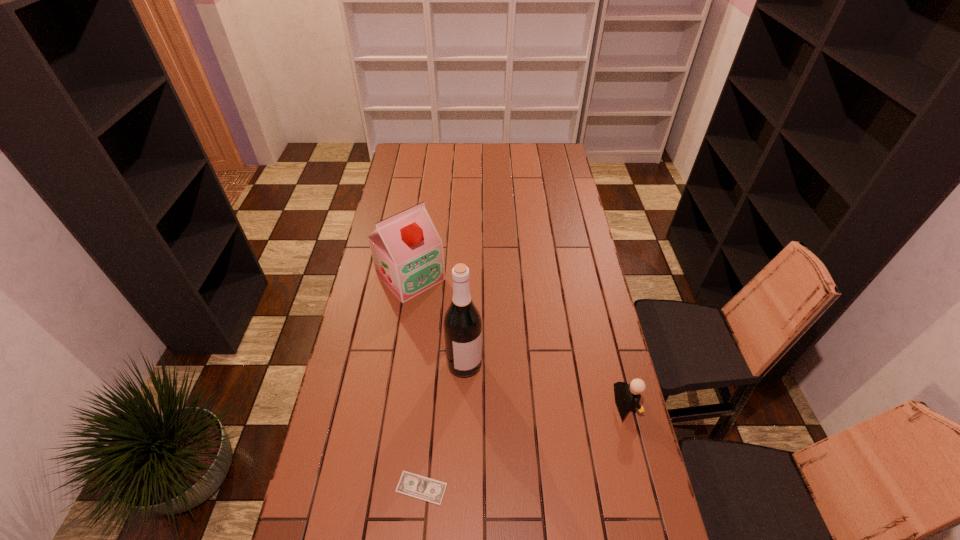
In the image, there is a desktop. Where is `vacant space at the right edge`? The image size is (960, 540). vacant space at the right edge is located at coordinates point(561,269).

This screenshot has width=960, height=540. What are the coordinates of `free space at the near left corner` in the screenshot? It's located at (311, 504).

Where is `vacant space in between the money and the tallest object`? vacant space in between the money and the tallest object is located at coordinates (443, 426).

Locate an element on the screen. The image size is (960, 540). vacant area that lies between the shortest object and the second nearest object is located at coordinates (524, 446).

Image resolution: width=960 pixels, height=540 pixels. Identify the location of empty space that is in between the rightmost object and the money. (524, 446).

Locate an element on the screen. This screenshot has width=960, height=540. vacant space in between the nearest object and the wine bottle is located at coordinates (443, 426).

The width and height of the screenshot is (960, 540). Find the location of `vacant area between the money and the tallest object`. vacant area between the money and the tallest object is located at coordinates pyautogui.click(x=443, y=426).

At what (x,y) coordinates should I click in order to perform the action: click on empty location between the second tallest object and the second nearest object. Please return your answer as a coordinate pair (x, y). This screenshot has height=540, width=960. Looking at the image, I should click on (518, 341).

You are a GUI agent. You are given a task and a screenshot of the screen. Output one action in this format:
    pyautogui.click(x=<x>, y=<y>)
    Task: Click on the free point between the third farthest object and the wine bottle
    
    Given the screenshot: What is the action you would take?
    pyautogui.click(x=545, y=384)

The height and width of the screenshot is (540, 960). I want to click on empty space that is in between the second nearest object and the wine bottle, so coord(545,384).